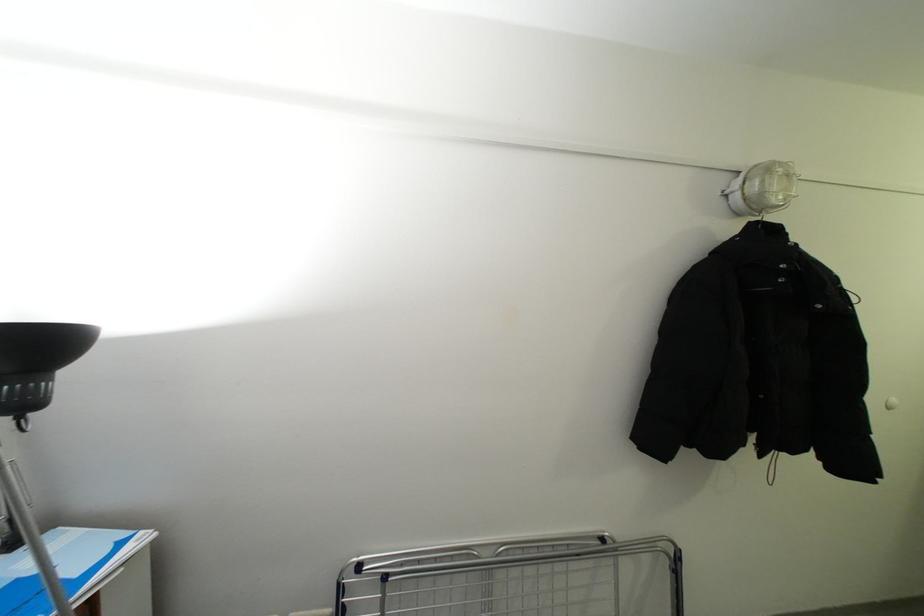
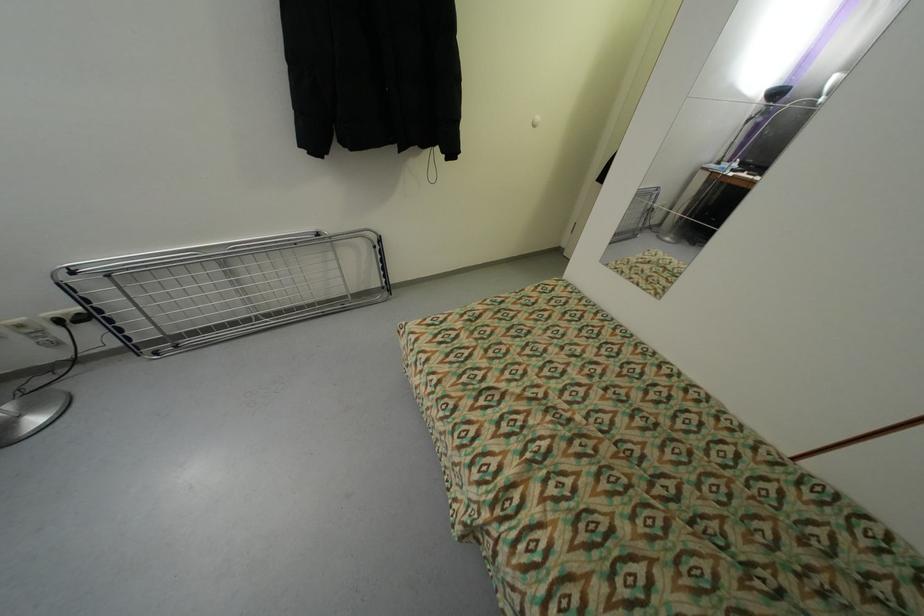
In the second image, find the point that corresponds to the point at 609,541 in the first image.

(323, 236)